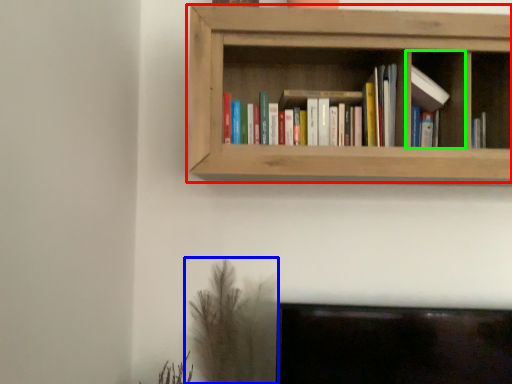
Question: Which object is the closest to the shelf (highlighted by a red box)? Choose among these: plant (highlighted by a blue box) or cabinet (highlighted by a green box).

Choices:
 (A) plant
 (B) cabinet

Answer: (B)